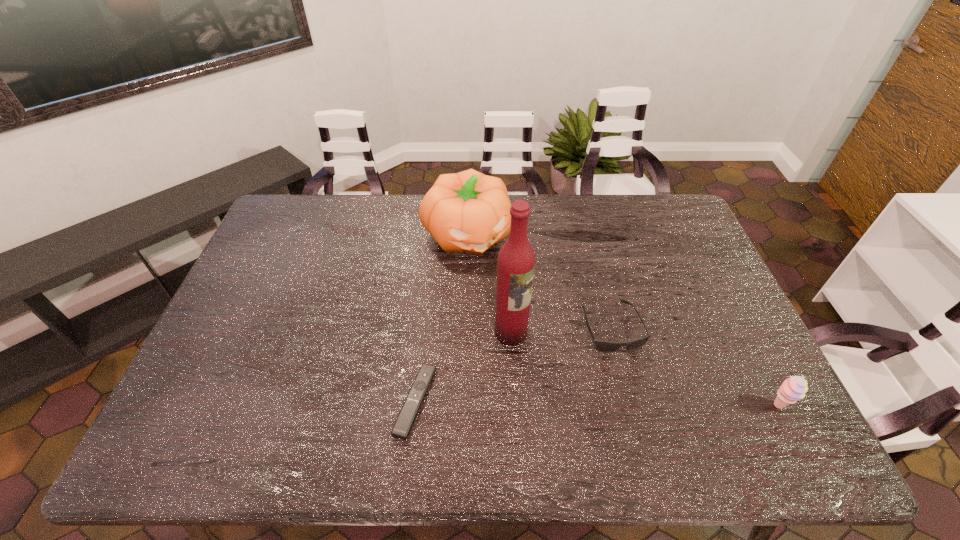
Locate an element on the screen. the closest object relative to the fourth object from left to right is located at coordinates (516, 260).